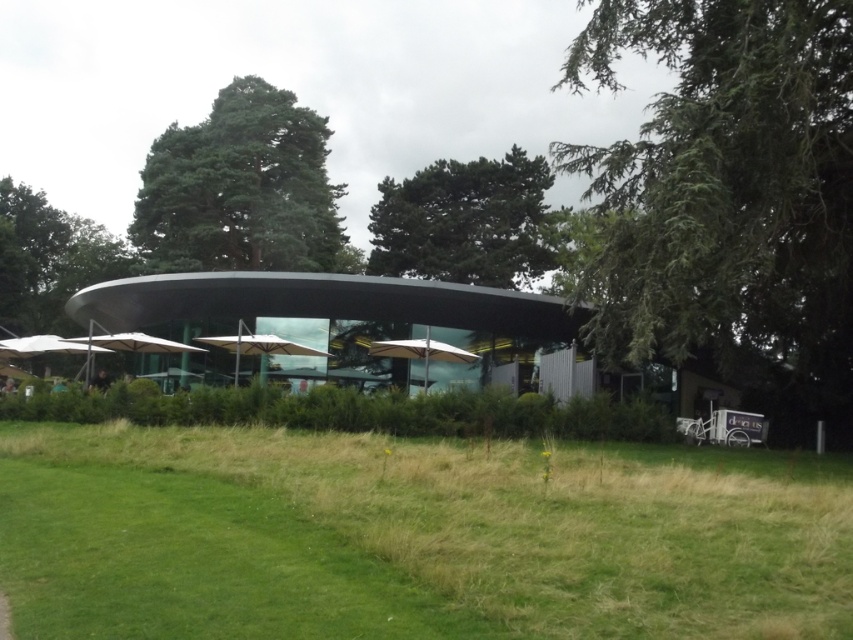
Question: Is green needle-like leaves at right wider than transparent glass umbrella at center?

Choices:
 (A) no
 (B) yes

Answer: (B)

Question: Which point is farther to the camera?

Choices:
 (A) green needle-like leaves at right
 (B) beige fabric umbrella at center
 (C) green textured tree at center

Answer: (C)

Question: Which object is the farthest from the green grassy field at lower center?

Choices:
 (A) green textured tree at center
 (B) green needle-like leaves at right

Answer: (A)

Question: Can you confirm if green leafy tree at upper center is positioned below white matte umbrella at left?

Choices:
 (A) no
 (B) yes

Answer: (A)

Question: Which of the following is the closest to the observer?

Choices:
 (A) (784, 148)
 (B) (512, 179)

Answer: (A)

Question: Is green needle-like leaves at right to the right of green textured tree at center from the viewer's perspective?

Choices:
 (A) yes
 (B) no

Answer: (A)